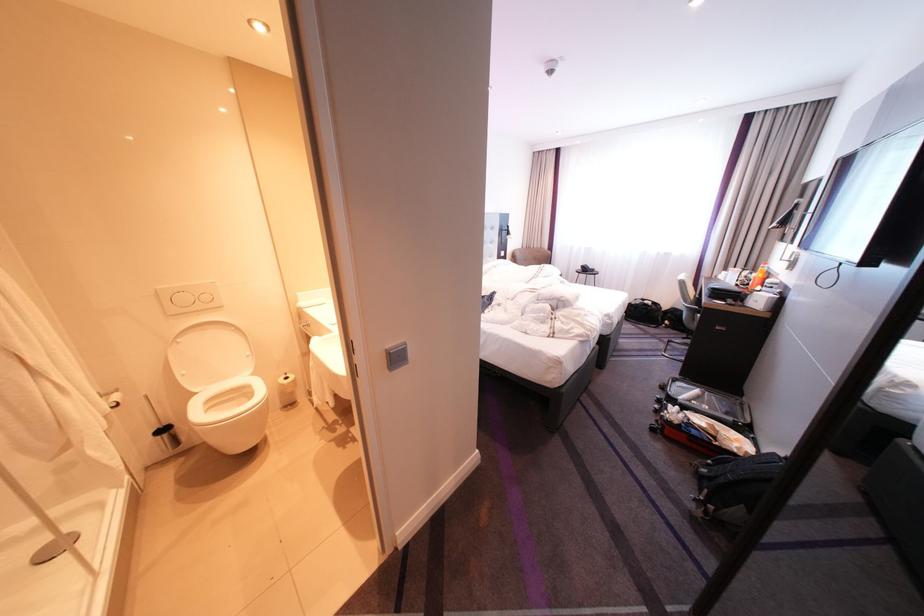
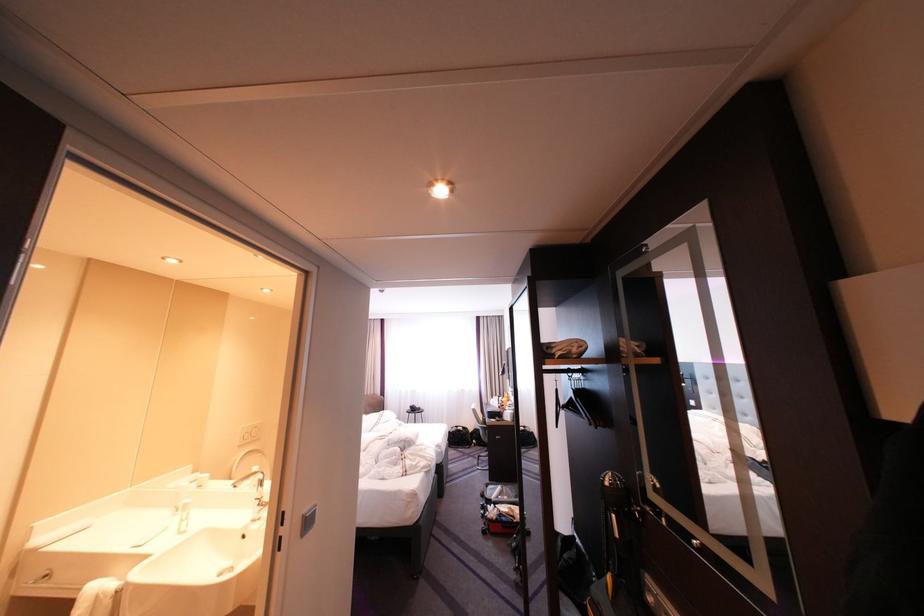
Find the pixel in the second image that matches (x=397, y=351) in the first image.

(314, 516)